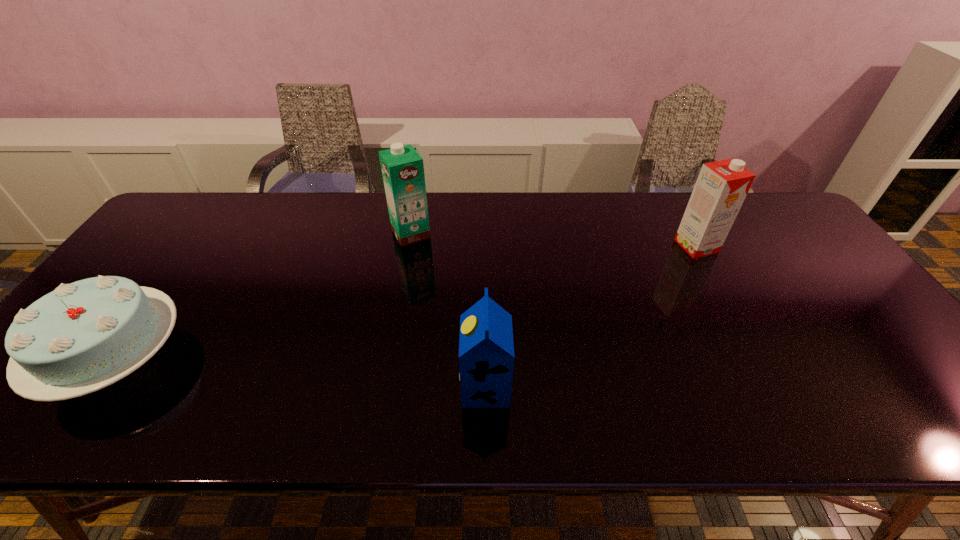
Where is `the second object from left to right`? This screenshot has width=960, height=540. the second object from left to right is located at coordinates (402, 167).

Identify the location of the rightmost object. (722, 186).

The height and width of the screenshot is (540, 960). I want to click on the second carton from left to right, so (x=486, y=350).

Find the location of a particular element. The image size is (960, 540). the nearest carton is located at coordinates (486, 350).

You are a GUI agent. You are given a task and a screenshot of the screen. Output one action in this format:
    pyautogui.click(x=<x>, y=<y>)
    Task: Click on the vacant space located on the front of the leftmost carton
    
    Given the screenshot: What is the action you would take?
    pyautogui.click(x=401, y=285)

Locate an element on the screen. The image size is (960, 540). vacant space located on the back of the rightmost object is located at coordinates (668, 194).

Where is `vacant space located with the cap open on the second object from right to left`? vacant space located with the cap open on the second object from right to left is located at coordinates (402, 387).

Locate an element on the screen. The height and width of the screenshot is (540, 960). vacant space positioned with the cap open on the second object from right to left is located at coordinates coord(293,387).

Find the location of a particular element. This screenshot has width=960, height=540. vacant space located 0.160m with the cap open on the second object from right to left is located at coordinates (389, 387).

Identify the location of object that is positioned at the near edge. The image size is (960, 540). (486, 350).